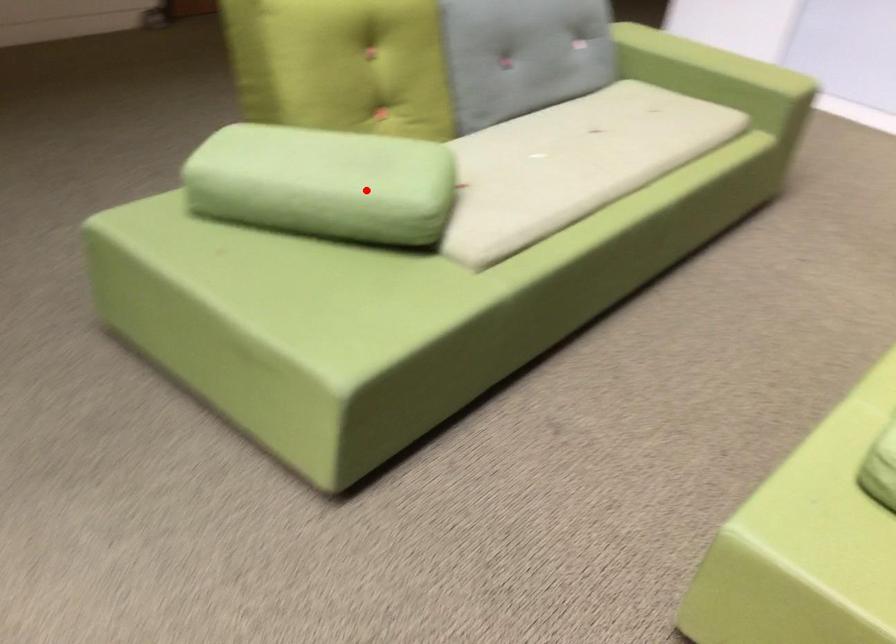
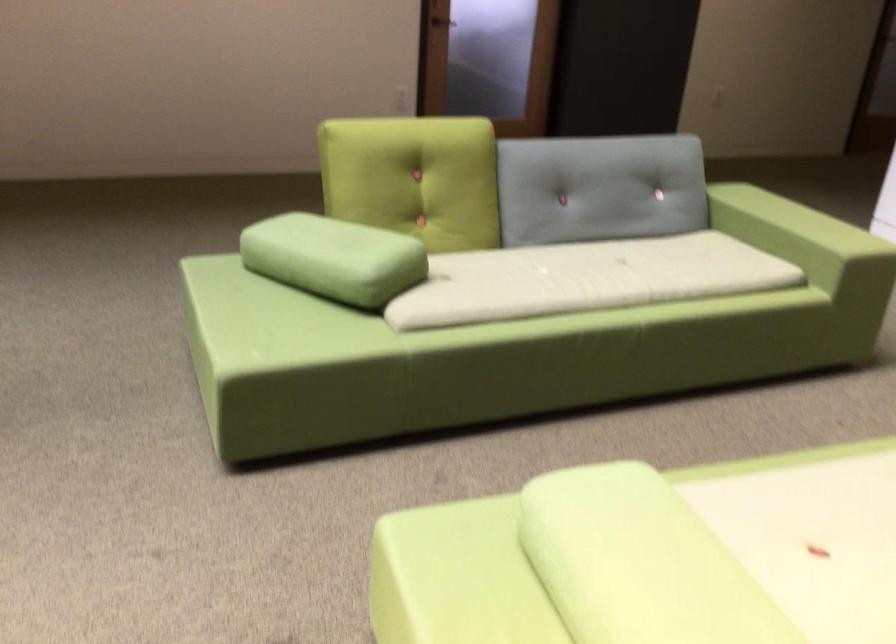
Where in the second image is the point corresponding to the highlighted location from the first image?

(333, 258)